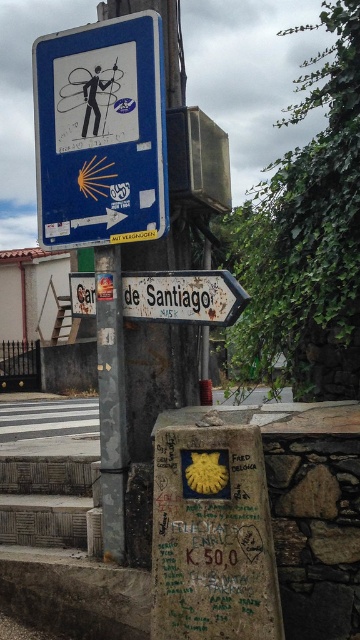
Is yellowmaterial/textureparking sign at center further to camera compared to metallic pole at center?

No, yellowmaterial/textureparking sign at center is closer to the viewer.

Who is lower down, yellowmaterial/textureparking sign at center or metallic pole at center?

Positioned lower is yellowmaterial/textureparking sign at center.

The image size is (360, 640). What are the coordinates of `yellowmaterial/textureparking sign at center` in the screenshot? It's located at (213, 536).

Find the location of a particular element. This screenshot has height=640, width=360. yellowmaterial/textureparking sign at center is located at coordinates (213, 536).

Between yellowmaterial/textureparking sign at center and white wooden signpost at center, which one appears on the right side from the viewer's perspective?

yellowmaterial/textureparking sign at center is more to the right.

In the scene shown: Does yellowmaterial/textureparking sign at center appear on the left side of white wooden signpost at center?

No, yellowmaterial/textureparking sign at center is not to the left of white wooden signpost at center.

Is point (245, 444) less distant than point (135, 273)?

Yes, point (245, 444) is in front of point (135, 273).

Locate an element on the screen. yellowmaterial/textureparking sign at center is located at coordinates (213, 536).

Does blue plastic sign at upper center have a smaller size compared to white wooden signpost at center?

No.

Can you confirm if blue plastic sign at upper center is positioned above white wooden signpost at center?

Yes, blue plastic sign at upper center is above white wooden signpost at center.

Between point (68, 58) and point (235, 310), which one is positioned behind?

The point (68, 58) is behind.

Identify the location of blue plastic sign at upper center. (101, 132).